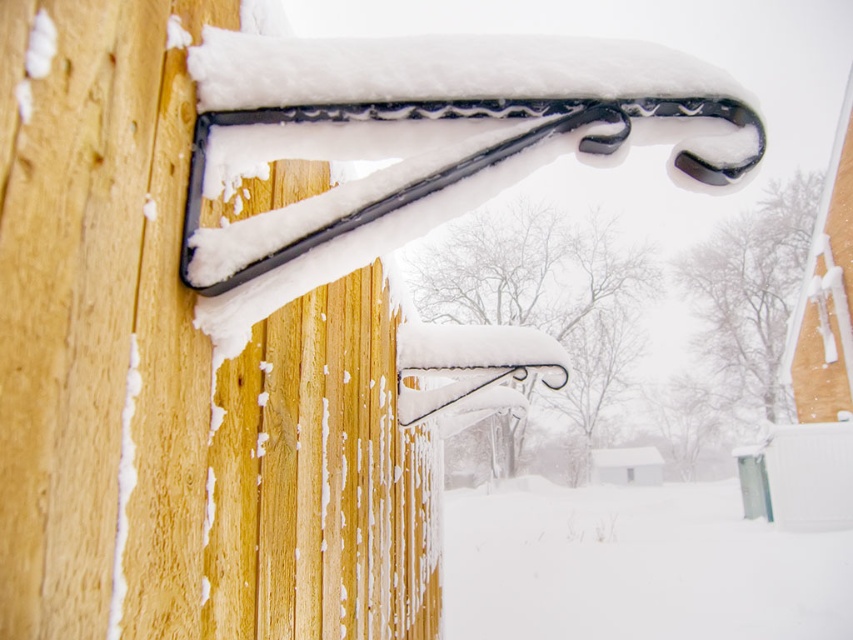
You are an architect designing a winter garden. You have a wooden fence at left and white fluffy snow at lower center in your design. Which object occupies more space in the scene?

The white fluffy snow at lower center occupies more space in the scene than the wooden fence at left, as the wooden fence at left has a smaller size compared to white fluffy snow at lower center.

Based on the photo, you are standing in the snowy winter scene and want to locate the wooden fence at left. According to the coordinates provided, where would you look to find it?

The wooden fence at left is located at point (178, 381).

You are a delivery person trying to reach the front door of the house, which is located at the lower center of the image. You are currently standing next to the wooden fence at left. The path between them is covered in snow. Do you think you can walk directly to the front door without stepping on the white fluffy snow at lower center if you stay on the path?

The wooden fence at left and white fluffy snow at lower center are 48.07 feet apart. Since the path is between them, you can walk directly to the front door without stepping on the white fluffy snow at lower center as long as you stay on the path.